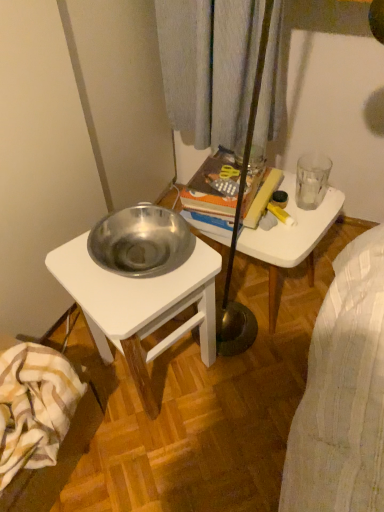
This screenshot has height=512, width=384. Identify the location of vacant region in front of polished silver bowl at left. (169, 458).